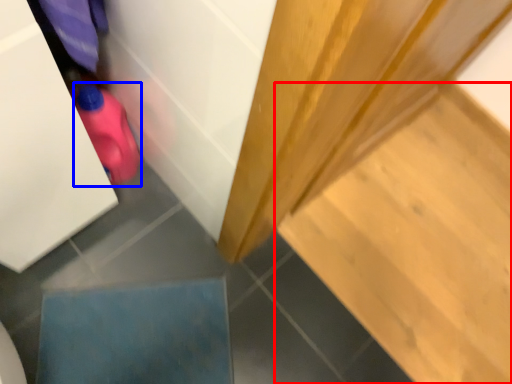
Question: Which object is further to the camera taking this photo, stair (highlighted by a red box) or stuff (highlighted by a blue box)?

Choices:
 (A) stair
 (B) stuff

Answer: (A)